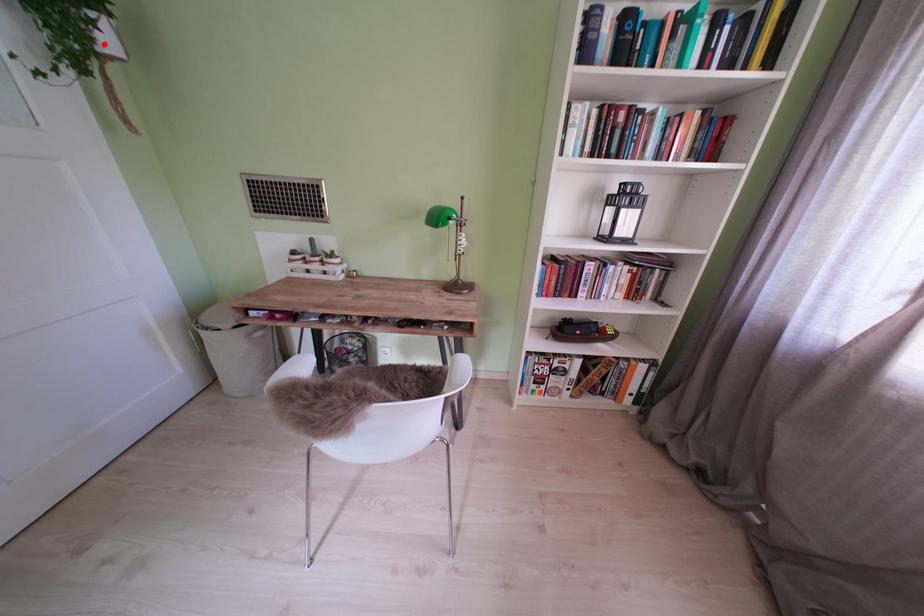
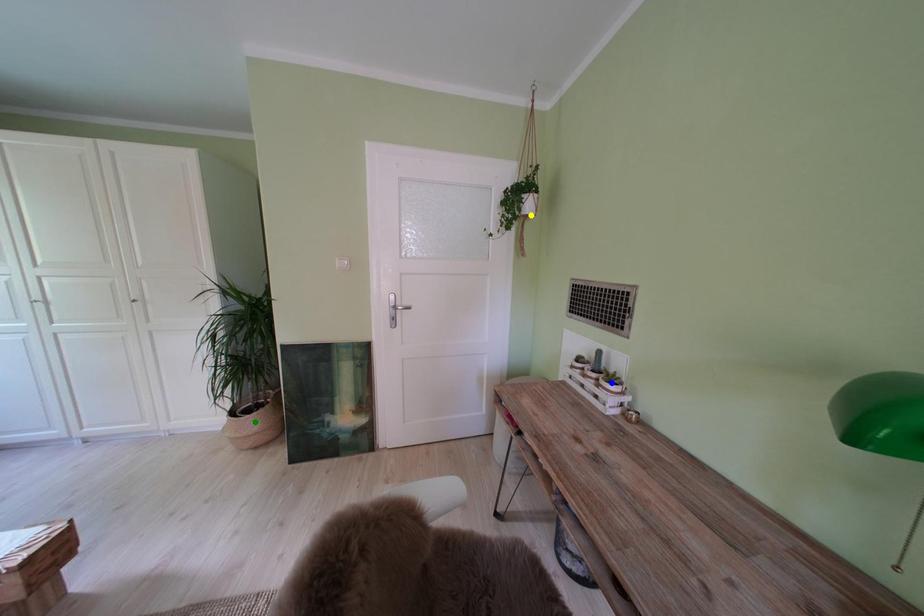
Question: I am providing you with two images of the same scene from different viewpoints. A red point is marked on the first image. You are given multiple points on the second image. Which point in image 2 represents the same 3d spot as the red point in image 1?

Choices:
 (A) yellow point
 (B) blue point
 (C) green point

Answer: (A)